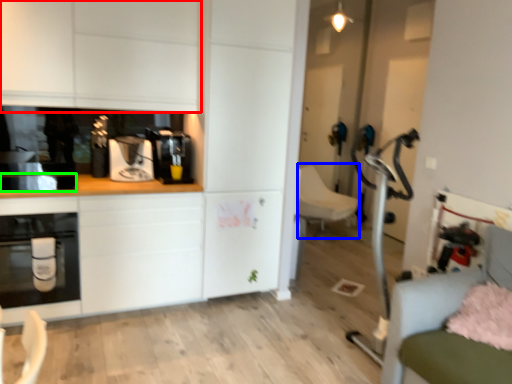
Question: Which object is the closest to the cabinetry (highlighted by a red box)? Choose among these: swivel chair (highlighted by a blue box) or appliance (highlighted by a green box).

Choices:
 (A) swivel chair
 (B) appliance

Answer: (B)